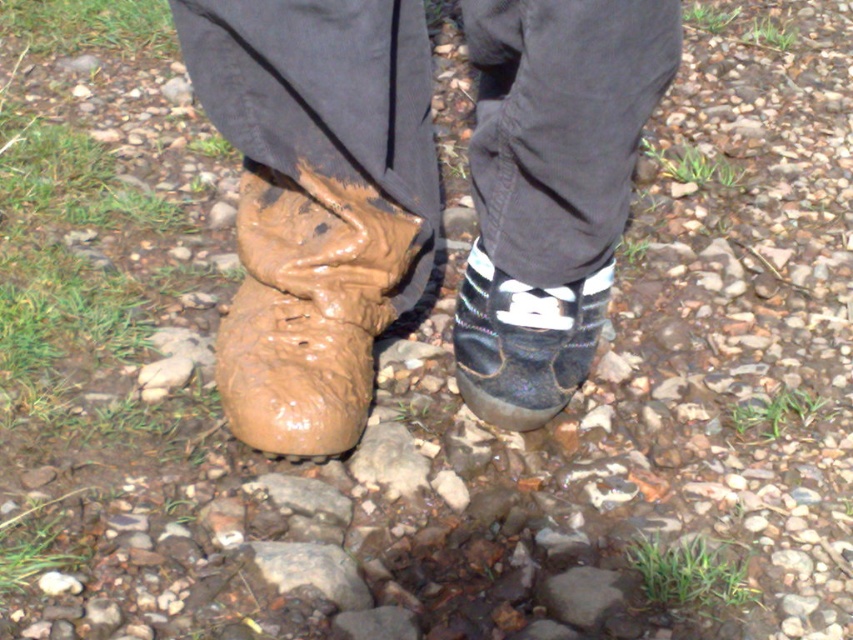
Question: Is the position of muddy rubber boot at left less distant than that of muddy rubber boot at lower left?

Choices:
 (A) yes
 (B) no

Answer: (A)

Question: Which object appears farthest from the camera in this image?

Choices:
 (A) shiny black shoe at lower center
 (B) muddy rubber boot at lower left
 (C) brown rough rock at center

Answer: (A)

Question: Is muddy rubber boot at left positioned at the back of muddy rubber boot at lower left?

Choices:
 (A) yes
 (B) no

Answer: (B)

Question: Does muddy rubber boot at lower left appear under brown rough rock at center?

Choices:
 (A) yes
 (B) no

Answer: (B)

Question: Which point appears farthest from the camera in this image?

Choices:
 (A) (346, 593)
 (B) (238, 323)

Answer: (B)

Question: Which point is closer to the camera?

Choices:
 (A) (357, 333)
 (B) (496, 276)
 (C) (271, 545)

Answer: (C)